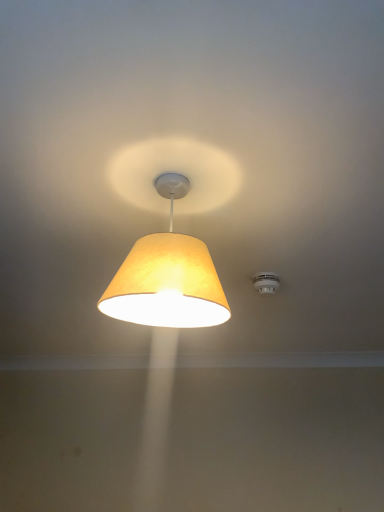
Measure the distance between white plastic smoke detector at upper right and camera.

white plastic smoke detector at upper right and camera are 5.09 feet apart.

Find the location of a particular element. The width and height of the screenshot is (384, 512). white plastic smoke detector at upper right is located at coordinates (266, 282).

The height and width of the screenshot is (512, 384). What do you see at coordinates (266, 282) in the screenshot?
I see `white plastic smoke detector at upper right` at bounding box center [266, 282].

This screenshot has width=384, height=512. What do you see at coordinates (167, 277) in the screenshot? I see `matte yellow fabric lampshade at center` at bounding box center [167, 277].

Find the location of a particular element. This screenshot has height=512, width=384. matte yellow fabric lampshade at center is located at coordinates (167, 277).

Locate an element on the screen. Image resolution: width=384 pixels, height=512 pixels. white plastic smoke detector at upper right is located at coordinates [266, 282].

Can you confirm if white plastic smoke detector at upper right is positioned to the right of matte yellow fabric lampshade at center?

Correct, you'll find white plastic smoke detector at upper right to the right of matte yellow fabric lampshade at center.

Which object is closer to the camera, white plastic smoke detector at upper right or matte yellow fabric lampshade at center?

matte yellow fabric lampshade at center is in front.

Is point (252, 280) behind point (142, 273)?

Yes, it is behind point (142, 273).

From the image's perspective, is white plastic smoke detector at upper right over matte yellow fabric lampshade at center?

No, from the image's perspective, white plastic smoke detector at upper right is not on top of matte yellow fabric lampshade at center.

From a real-world perspective, is white plastic smoke detector at upper right on top of matte yellow fabric lampshade at center?

Yes, from a real-world perspective, white plastic smoke detector at upper right is on top of matte yellow fabric lampshade at center.

Which of these two, white plastic smoke detector at upper right or matte yellow fabric lampshade at center, is wider?

matte yellow fabric lampshade at center is wider.

Which of these two, white plastic smoke detector at upper right or matte yellow fabric lampshade at center, stands shorter?

white plastic smoke detector at upper right.

Between white plastic smoke detector at upper right and matte yellow fabric lampshade at center, which one has larger size?

matte yellow fabric lampshade at center is bigger.

From the picture: Which is correct: white plastic smoke detector at upper right is inside matte yellow fabric lampshade at center, or outside of it?

The correct answer is: outside.

Is white plastic smoke detector at upper right next to matte yellow fabric lampshade at center and touching it?

No.

Is white plastic smoke detector at upper right aimed at matte yellow fabric lampshade at center?

Yes, white plastic smoke detector at upper right is aimed at matte yellow fabric lampshade at center.

Find the location of a particular element. lighting below the matte yellow fabric lampshade at center (from the image's perspective) is located at coordinates (266, 282).

Between matte yellow fabric lampshade at center and white plastic smoke detector at upper right, which one appears on the right side from the viewer's perspective?

white plastic smoke detector at upper right is more to the right.

Is the position of matte yellow fabric lampshade at center less distant than that of white plastic smoke detector at upper right?

That is True.

Is point (199, 305) closer to viewer compared to point (275, 275)?

That is True.

From the image's perspective, relative to white plastic smoke detector at upper right, is matte yellow fabric lampshade at center above or below?

From the image's perspective, matte yellow fabric lampshade at center appears above white plastic smoke detector at upper right.

From a real-world perspective, is matte yellow fabric lampshade at center physically located above or below white plastic smoke detector at upper right?

From a real-world perspective, matte yellow fabric lampshade at center is physically below white plastic smoke detector at upper right.

Is matte yellow fabric lampshade at center thinner than white plastic smoke detector at upper right?

No.

Considering the relative sizes of matte yellow fabric lampshade at center and white plastic smoke detector at upper right in the image provided, is matte yellow fabric lampshade at center shorter than white plastic smoke detector at upper right?

Incorrect, the height of matte yellow fabric lampshade at center does not fall short of that of white plastic smoke detector at upper right.

Based on their sizes in the image, would you say matte yellow fabric lampshade at center is bigger or smaller than white plastic smoke detector at upper right?

In the image, matte yellow fabric lampshade at center appears to be larger than white plastic smoke detector at upper right.

Is matte yellow fabric lampshade at center completely or partially outside of white plastic smoke detector at upper right?

Yes.

Is matte yellow fabric lampshade at center positioned far away from white plastic smoke detector at upper right?

They are positioned close to each other.

Does matte yellow fabric lampshade at center turn towards white plastic smoke detector at upper right?

No, matte yellow fabric lampshade at center is not facing towards white plastic smoke detector at upper right.

How much distance is there between matte yellow fabric lampshade at center and white plastic smoke detector at upper right?

A distance of 26.02 inches exists between matte yellow fabric lampshade at center and white plastic smoke detector at upper right.

The image size is (384, 512). Find the location of `lighting located behind the matte yellow fabric lampshade at center`. lighting located behind the matte yellow fabric lampshade at center is located at coordinates click(266, 282).

Locate an element on the screen. The width and height of the screenshot is (384, 512). lamp above the white plastic smoke detector at upper right (from the image's perspective) is located at coordinates (167, 277).

Where is `lamp below the white plastic smoke detector at upper right (from a real-world perspective)`? The height and width of the screenshot is (512, 384). lamp below the white plastic smoke detector at upper right (from a real-world perspective) is located at coordinates (167, 277).